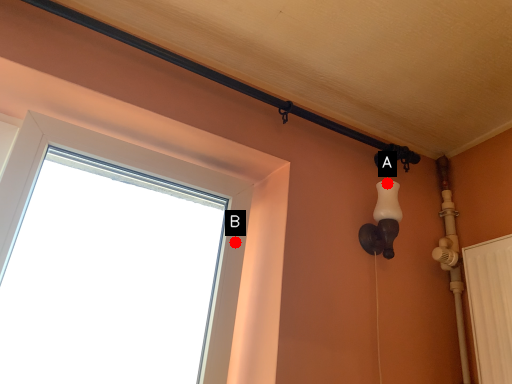
Question: Two points are circled on the image, labeled by A and B beside each circle. Which point appears closest to the camera in this image?

Choices:
 (A) A is closer
 (B) B is closer

Answer: (B)